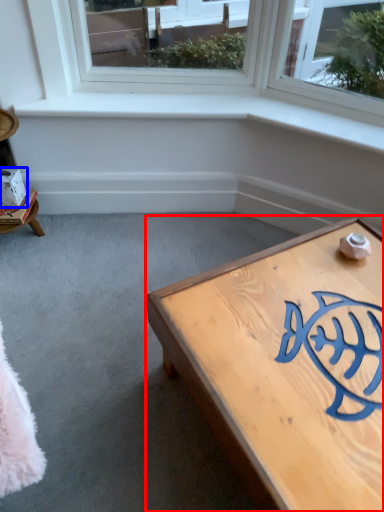
Question: Which object appears closest to the camera in this image, coffee table (highlighted by a red box) or box (highlighted by a blue box)?

Choices:
 (A) coffee table
 (B) box

Answer: (A)